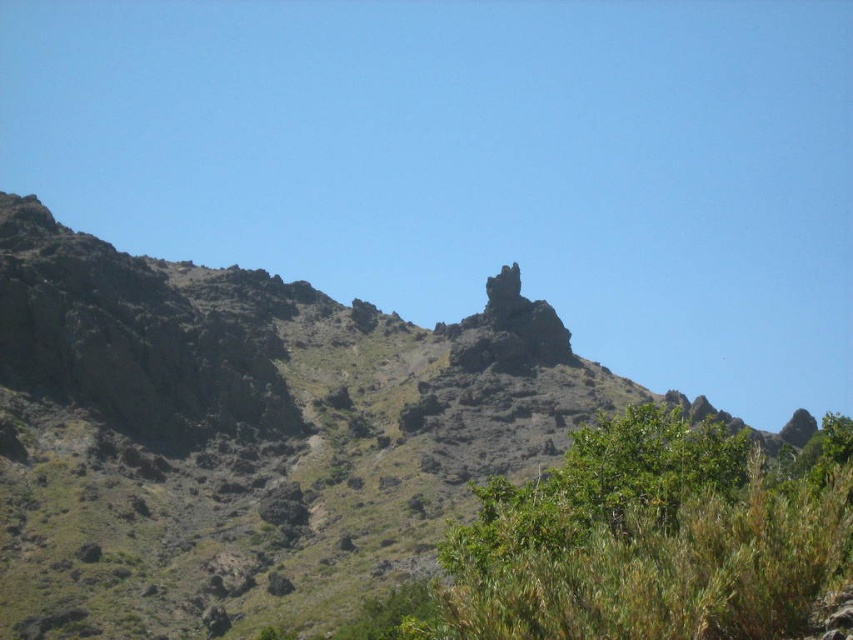
Question: Which point is farther from the camera taking this photo?

Choices:
 (A) (543, 333)
 (B) (293, 456)

Answer: (A)

Question: Does rugged rock formation at center have a smaller size compared to green leafy shrub at center?

Choices:
 (A) yes
 (B) no

Answer: (B)

Question: Is rugged rock formation at center positioned behind rugged stone rock formation at center?

Choices:
 (A) no
 (B) yes

Answer: (A)

Question: Is the position of green leafy shrub at center more distant than that of rugged stone rock formation at center?

Choices:
 (A) yes
 (B) no

Answer: (B)

Question: Considering the real-world distances, which object is farthest from the rugged rock formation at center?

Choices:
 (A) green leafy shrub at center
 (B) rugged stone rock formation at center

Answer: (A)

Question: Which object is the closest to the rugged stone rock formation at center?

Choices:
 (A) green leafy shrub at center
 (B) rugged rock formation at center

Answer: (B)